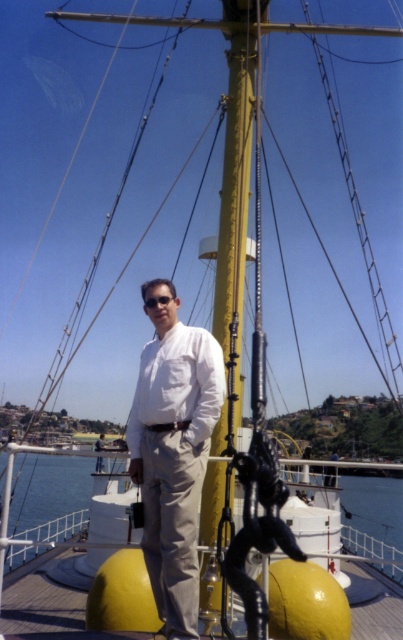
Question: Among these points, which one is nearest to the camera?

Choices:
 (A) (386, 547)
 (B) (203, 428)
 (C) (205, 458)
 (D) (97, 445)

Answer: (B)

Question: Does white cotton shirt at center lie behind white matte shirt at center?

Choices:
 (A) yes
 (B) no

Answer: (B)

Question: Does white matte dress shirt at center have a lesser width compared to transparent water at lower center?

Choices:
 (A) no
 (B) yes

Answer: (B)

Question: Which point is closer to the camera?

Choices:
 (A) (95, 444)
 (B) (147, 298)
 (C) (386, 500)
 (D) (162, 428)

Answer: (D)

Question: Which object is positioned closest to the transparent water at lower center?

Choices:
 (A) white matte dress shirt at center
 (B) white cotton shirt at center
 (C) white matte shirt at center

Answer: (C)

Question: Is white cotton shirt at center to the left of transparent water at lower center from the viewer's perspective?

Choices:
 (A) no
 (B) yes

Answer: (B)